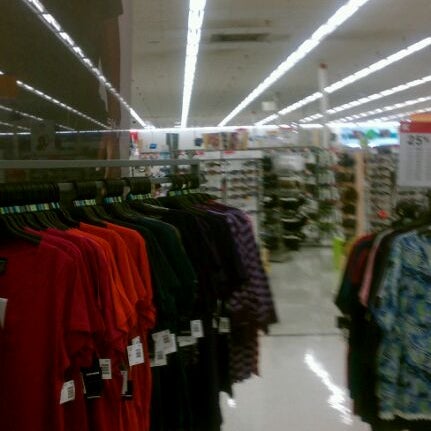
Where is `hangers`? The height and width of the screenshot is (431, 431). hangers is located at coordinates 139,190.